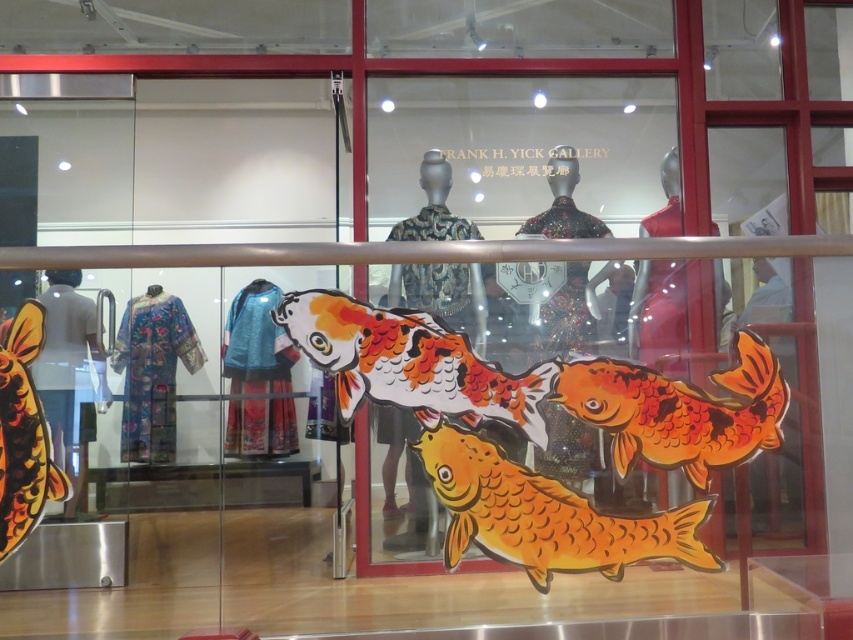
Which is more to the left, orange matte fish at center or shiny orange fish at lower left?

From the viewer's perspective, shiny orange fish at lower left appears more on the left side.

How far apart are orange matte fish at center and shiny orange fish at lower left?

They are 1.03 meters apart.

This screenshot has height=640, width=853. What do you see at coordinates (544, 515) in the screenshot?
I see `orange matte fish at center` at bounding box center [544, 515].

The width and height of the screenshot is (853, 640). In order to click on orange matte fish at center in this screenshot , I will do `click(544, 515)`.

Looking at this image, how far apart are orange matte fish at center and orange glossy koi at center?

22.03 centimeters

Does point (721, 561) come behind point (636, 369)?

No, it is not.

Locate an element on the screen. This screenshot has height=640, width=853. orange matte fish at center is located at coordinates (544, 515).

Can you confirm if orange glossy koi at center is positioned below shiny orange fish at lower left?

Actually, orange glossy koi at center is above shiny orange fish at lower left.

Who is positioned more to the left, orange glossy koi at center or shiny orange fish at lower left?

Positioned to the left is shiny orange fish at lower left.

The height and width of the screenshot is (640, 853). What do you see at coordinates (680, 410) in the screenshot?
I see `orange glossy koi at center` at bounding box center [680, 410].

Identify the location of orange glossy koi at center. The image size is (853, 640). (680, 410).